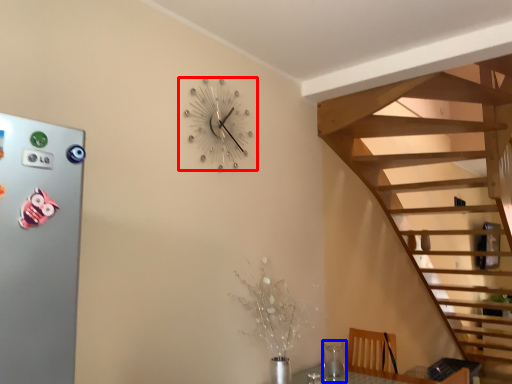
Question: Which object appears closest to the camera in this image, wall clock (highlighted by a red box) or glass vase (highlighted by a blue box)?

Choices:
 (A) wall clock
 (B) glass vase

Answer: (A)